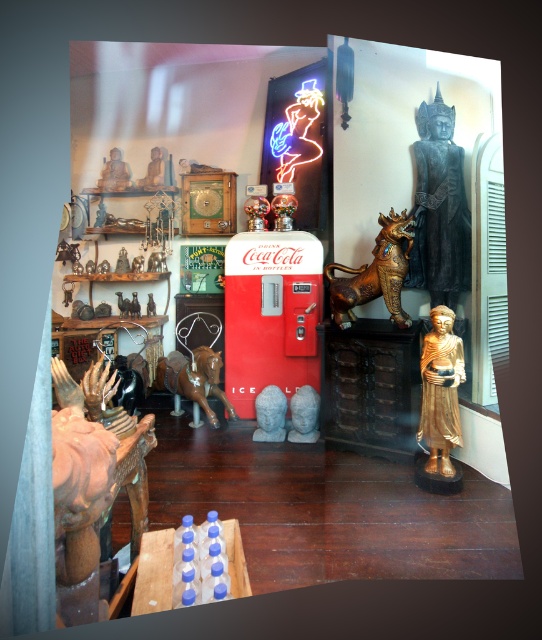
You are a customer in the shop and want to take a photo of both the gold polished statue at right and the matte gold statue at upper left. Which statue should you move closer to first to ensure both are in the frame?

You should move closer to the gold polished statue at right first because it is in front of the matte gold statue at upper left, so adjusting your position to include both would require focusing on the closer object first.

You are a delivery person who needs to place a package between the brown wooden horse at center and the matte gold statue at upper left. The package requires at least 1.5 meters of space to fit. Can you place it there?

The brown wooden horse at center and matte gold statue at upper left are 1.60 meters apart, so yes, the package can be placed between them as the distance is sufficient.

You are an interior designer planning to move the brown wooden horse at center and the matte gold statue at upper left closer together. Based on their sizes, which object would require more space to accommodate during the move?

The brown wooden horse at center is bigger than the matte gold statue at upper left, so it would require more space to accommodate during the move.